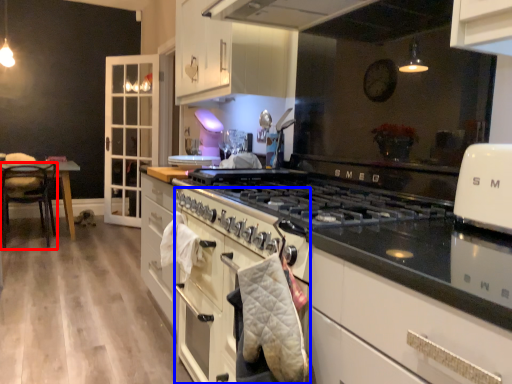
Question: Among these objects, which one is nearest to the camera, chair (highlighted by a red box) or oven (highlighted by a blue box)?

Choices:
 (A) chair
 (B) oven

Answer: (B)